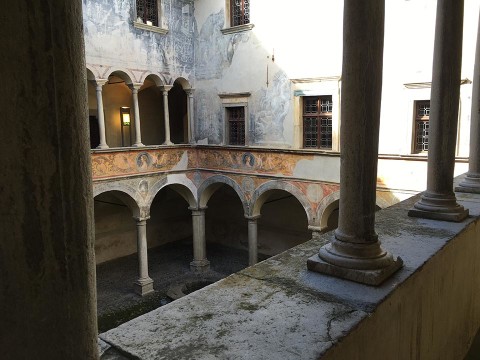
Locate an element on the screen. This screenshot has height=360, width=480. 1 light is located at coordinates (128, 117).